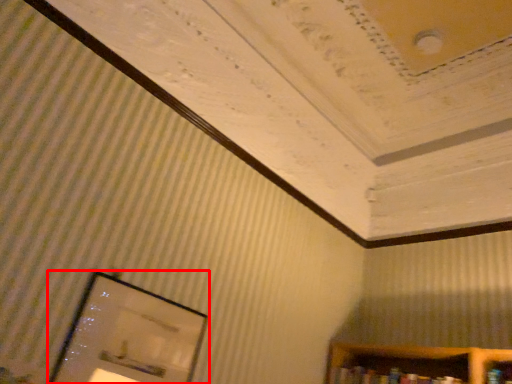
Question: Observing the image, what is the correct spatial positioning of picture frame (annotated by the red box) in reference to book?

Choices:
 (A) left
 (B) right

Answer: (A)